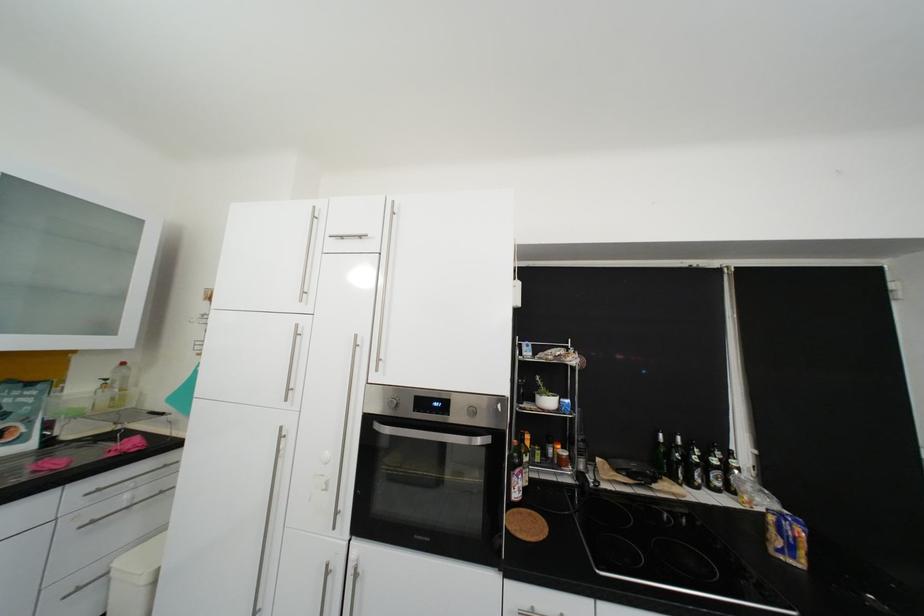
Which object does [544,397] point to?

It corresponds to the small potted plant in the image.